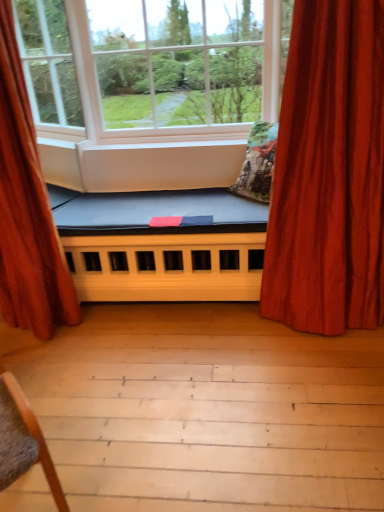
I want to click on free point in front of velvet red curtain at right, the 1th curtain when ordered from right to left, so 327,377.